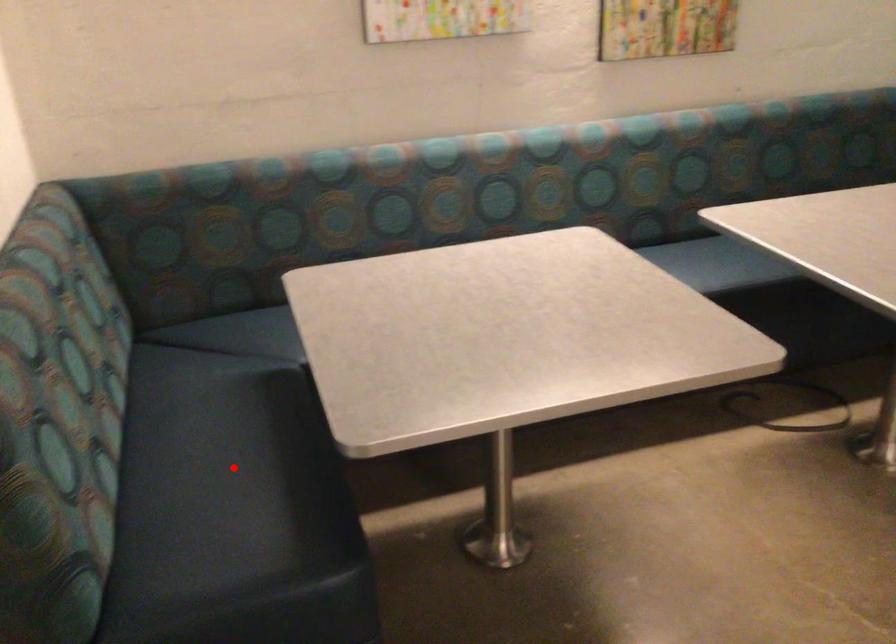
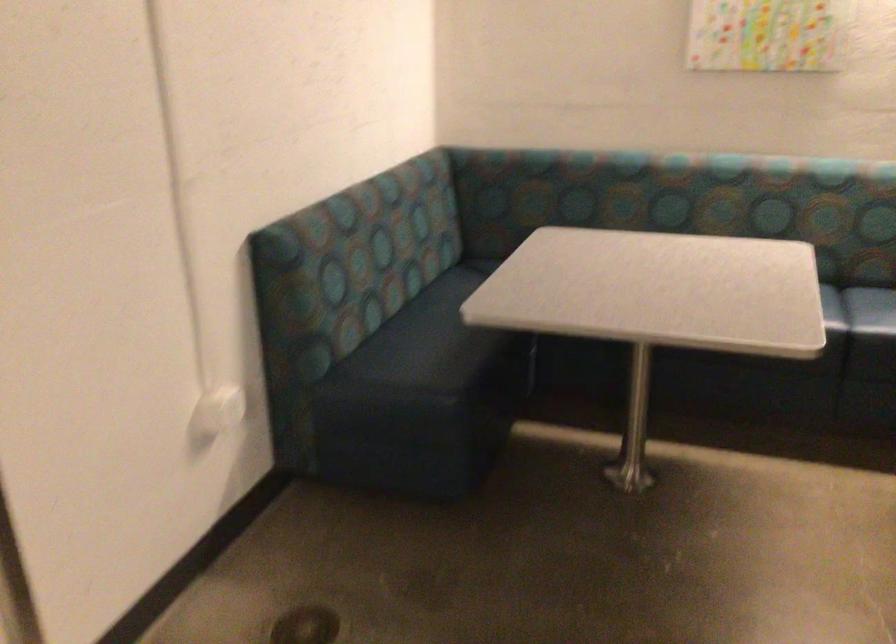
Locate, in the second image, the point that corresponds to the highlighted location in the first image.

(440, 337)